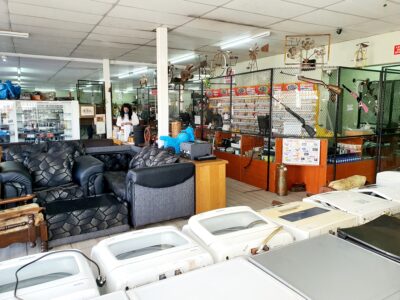
Identify the location of white appliances. (59, 282), (153, 261), (252, 236), (363, 202), (387, 189), (238, 288), (118, 294).